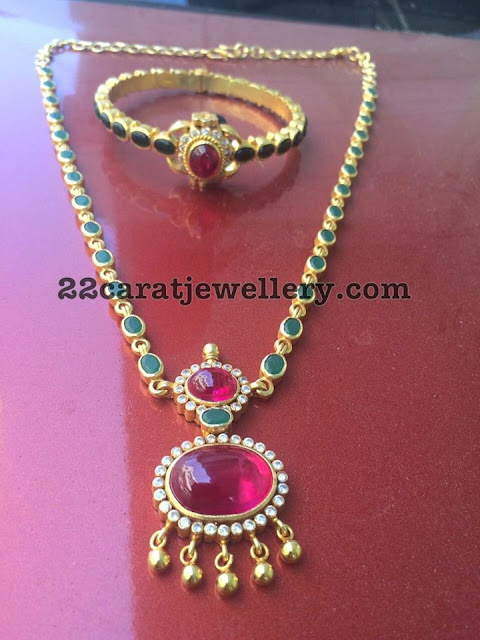
The width and height of the screenshot is (480, 640). In order to click on gold braid trim in this screenshot , I will do `click(209, 138)`.